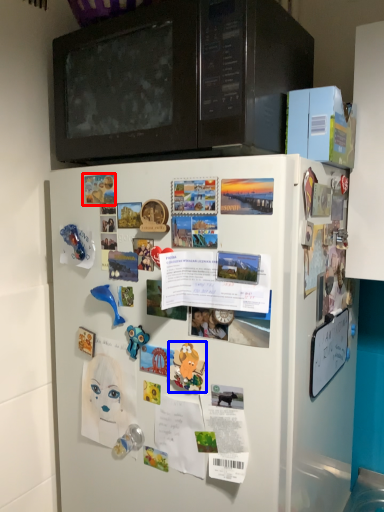
Question: Which of the following is the closest to the observer, poster (highlighted by a red box) or toy (highlighted by a blue box)?

Choices:
 (A) poster
 (B) toy

Answer: (B)